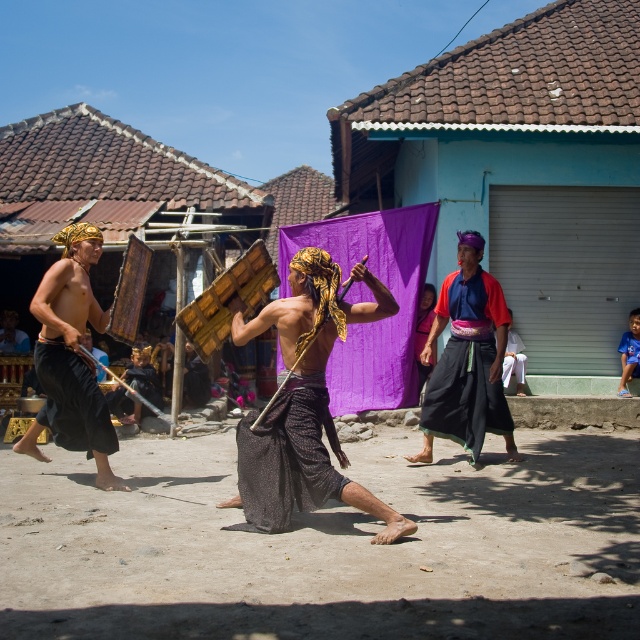
You are a photographer standing at the edge of the performance area. You want to take a photo that includes both the matte black shield at left and the black textured cloth at center. Given that your camera has a maximum focus range of 2 meters, will you be able to capture both objects in focus without moving your position?

The matte black shield at left and black textured cloth at center are 2.06 meters apart. Since the distance between them exceeds the camera maximum focus range of 2 meters, you will not be able to capture both objects in focus without moving your position.

You are a photographer standing in the middle of the performance area. You want to capture a clear shot of the matte brown wooden staff at center without the black textured cloth at center blocking it. Is the staff visible above the cloth?

The matte brown wooden staff at center is positioned over the black textured cloth at center, so yes, the staff is visible above the cloth and can be captured clearly without obstruction.

You are an event organizer setting up a stage for a cultural performance. You have a matte brown wooden staff at center and a black textured cloth at center. Which object is wider?

The matte brown wooden staff at center is wider than the black textured cloth at center.